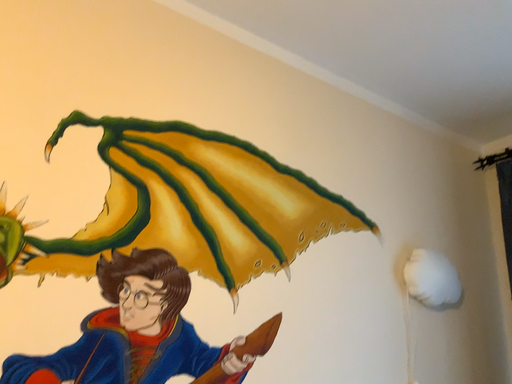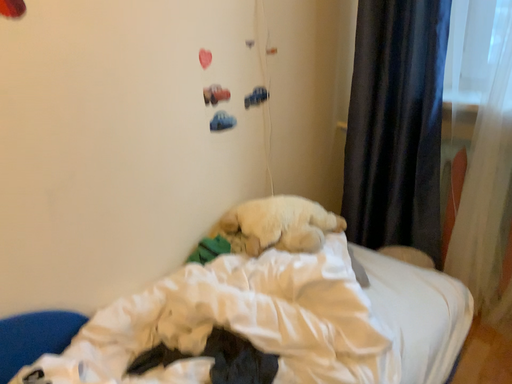
Question: Which way did the camera rotate in the video?

Choices:
 (A) rotated downward
 (B) rotated upward

Answer: (A)